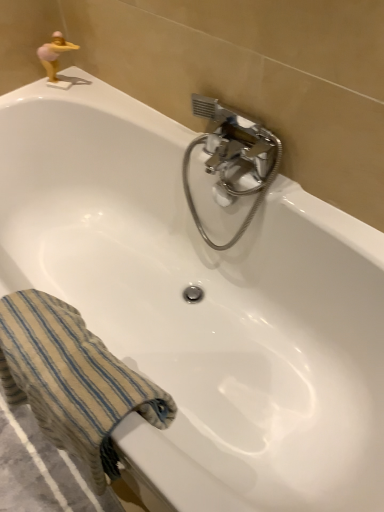
Where is `chrome metallic faucet at upper center`? Image resolution: width=384 pixels, height=512 pixels. chrome metallic faucet at upper center is located at coordinates (233, 158).

Considering the sizes of gold plastic figurine at upper left and beige striped towel at lower left in the image, is gold plastic figurine at upper left wider or thinner than beige striped towel at lower left?

gold plastic figurine at upper left is thinner than beige striped towel at lower left.

From a real-world perspective, is gold plastic figurine at upper left positioned above or below beige striped towel at lower left?

From a real-world perspective, gold plastic figurine at upper left is physically above beige striped towel at lower left.

Does gold plastic figurine at upper left have a greater height compared to beige striped towel at lower left?

No.

What's the angular difference between gold plastic figurine at upper left and beige striped towel at lower left's facing directions?

There is a 28.1-degree angle between the facing directions of gold plastic figurine at upper left and beige striped towel at lower left.

Is chrome metallic faucet at upper center spatially inside beige striped towel at lower left, or outside of it?

chrome metallic faucet at upper center is spatially situated outside beige striped towel at lower left.

From the picture: Is chrome metallic faucet at upper center placed right next to beige striped towel at lower left?

No, chrome metallic faucet at upper center is not with beige striped towel at lower left.

Is point (207, 170) behind point (109, 408)?

Yes, point (207, 170) is farther from viewer.

Is the position of chrome metallic faucet at upper center less distant than that of beige striped towel at lower left?

No, it is behind beige striped towel at lower left.

Considering the sizes of objects chrome metallic faucet at upper center and gold plastic figurine at upper left in the image provided, who is bigger, chrome metallic faucet at upper center or gold plastic figurine at upper left?

chrome metallic faucet at upper center is bigger.

From the image's perspective, would you say chrome metallic faucet at upper center is positioned over gold plastic figurine at upper left?

No.

Is chrome metallic faucet at upper center outside of gold plastic figurine at upper left?

Yes, chrome metallic faucet at upper center is outside of gold plastic figurine at upper left.

From the picture: Does gold plastic figurine at upper left have a lesser width compared to chrome metallic faucet at upper center?

Indeed, gold plastic figurine at upper left has a lesser width compared to chrome metallic faucet at upper center.

Can you see gold plastic figurine at upper left touching chrome metallic faucet at upper center?

There is a gap between gold plastic figurine at upper left and chrome metallic faucet at upper center.

Where is `miniature behind the chrome metallic faucet at upper center`? This screenshot has height=512, width=384. miniature behind the chrome metallic faucet at upper center is located at coordinates (54, 54).

Is chrome metallic faucet at upper center completely or partially inside gold plastic figurine at upper left?

No, chrome metallic faucet at upper center is located outside of gold plastic figurine at upper left.

Is point (66, 411) closer or farther from the camera than point (218, 170)?

Point (66, 411) appears to be closer to the viewer than point (218, 170).

In the image, there is a chrome metallic faucet at upper center. At what (x,y) coordinates should I click in order to perform the action: click on towel/napkin below it (from a real-world perspective). Please return your answer as a coordinate pair (x, y). Looking at the image, I should click on (72, 380).

Is beige striped towel at lower left spatially inside chrome metallic faucet at upper center, or outside of it?

beige striped towel at lower left lies outside chrome metallic faucet at upper center.

Is there a large distance between beige striped towel at lower left and gold plastic figurine at upper left?

Yes, beige striped towel at lower left and gold plastic figurine at upper left are quite far apart.

Based on the photo, between beige striped towel at lower left and gold plastic figurine at upper left, which one has larger size?

beige striped towel at lower left.

In the scene shown: Is beige striped towel at lower left not within gold plastic figurine at upper left?

Yes.

Would you say beige striped towel at lower left is to the left or to the right of gold plastic figurine at upper left in the picture?

Clearly, beige striped towel at lower left is on the right of gold plastic figurine at upper left in the image.

Find the location of `towel/napkin lying in front of the gold plastic figurine at upper left`. towel/napkin lying in front of the gold plastic figurine at upper left is located at coordinates (72, 380).

Locate an element on the screen. The width and height of the screenshot is (384, 512). towel/napkin that is below the chrome metallic faucet at upper center (from the image's perspective) is located at coordinates (72, 380).

When comparing their distances from gold plastic figurine at upper left, does beige striped towel at lower left or chrome metallic faucet at upper center seem closer?

Based on the image, chrome metallic faucet at upper center appears to be nearer to gold plastic figurine at upper left.

Based on their spatial positions, is chrome metallic faucet at upper center or gold plastic figurine at upper left closer to beige striped towel at lower left?

chrome metallic faucet at upper center is positioned closer to the anchor beige striped towel at lower left.

When comparing their distances from chrome metallic faucet at upper center, does beige striped towel at lower left or gold plastic figurine at upper left seem further?

gold plastic figurine at upper left is positioned further to the anchor chrome metallic faucet at upper center.

Considering their positions, is chrome metallic faucet at upper center positioned closer to gold plastic figurine at upper left than beige striped towel at lower left?

chrome metallic faucet at upper center.

Estimate the real-world distances between objects in this image. Which object is closer to beige striped towel at lower left, gold plastic figurine at upper left or chrome metallic faucet at upper center?

chrome metallic faucet at upper center.

Looking at the image, which one is located closer to chrome metallic faucet at upper center, gold plastic figurine at upper left or beige striped towel at lower left?

Based on the image, beige striped towel at lower left appears to be nearer to chrome metallic faucet at upper center.

What are the coordinates of `plumbing fixture between gold plastic figurine at upper left and beige striped towel at lower left from top to bottom` in the screenshot? It's located at (233, 158).